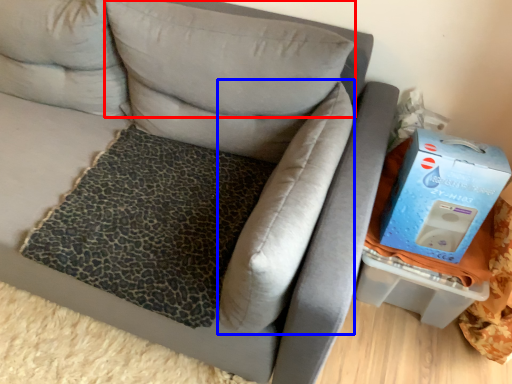
Question: Which object is closer to the camera taking this photo, pillow (highlighted by a red box) or pillow (highlighted by a blue box)?

Choices:
 (A) pillow
 (B) pillow

Answer: (B)